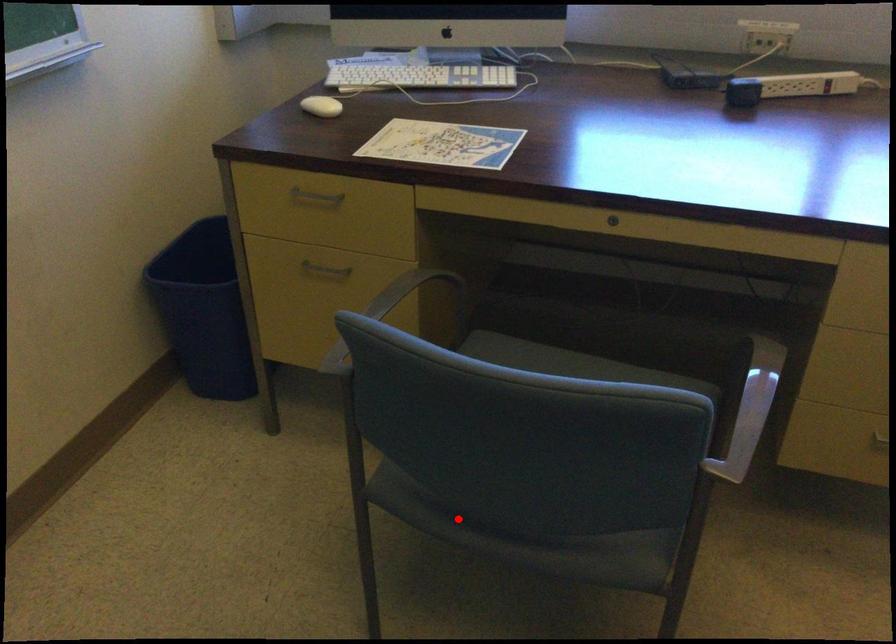
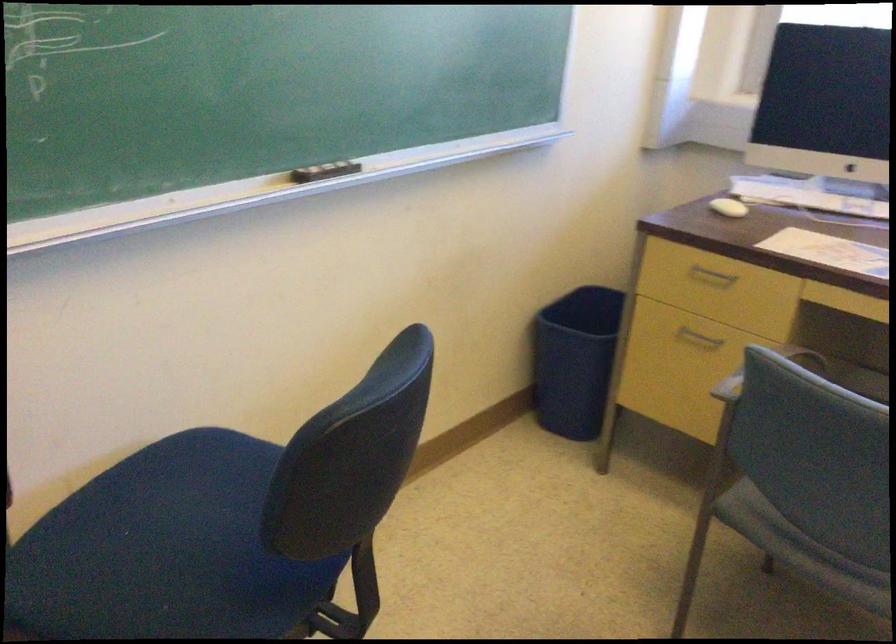
Question: A red point is marked in image1. In image2, is the corresponding 3D point closer to the camera or farther? Reply with the corresponding letter.

Choices:
 (A) The corresponding 3D point is closer.
 (B) The corresponding 3D point is farther.

Answer: (B)